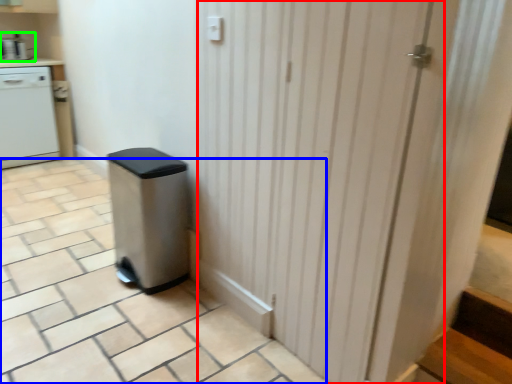
Question: Which is farther away from screen door (highlighted by a red box)? tile (highlighted by a blue box) or kitchen appliance (highlighted by a green box)?

Choices:
 (A) tile
 (B) kitchen appliance

Answer: (B)